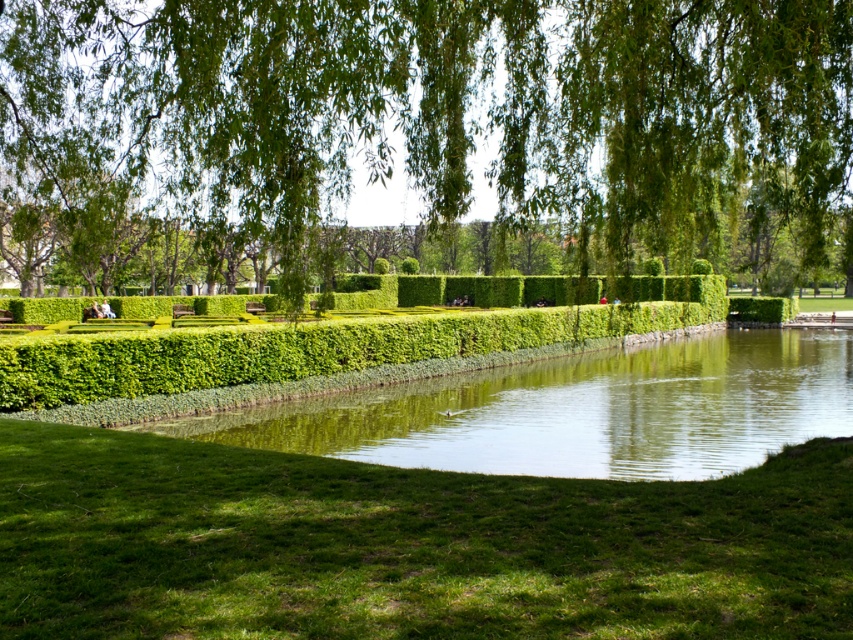
Looking at this image, you are a bird flying over the park and want to land on the green leafy willow at upper center before resting on the green smooth water at center. Which direction should you fly to reach the willow first?

The green leafy willow at upper center is to the left of the green smooth water at center, so you should fly to the left to reach the willow first before moving towards the water.

You are planning to place a picnic blanket in the park. The picnic blanket is 2 meters wide. You see the green grass at lower center and the green leafy hedge at center. Which area can accommodate the picnic blanket without overlapping the hedge?

The green grass at lower center has a width of less than 2 meters, so it cannot accommodate the picnic blanket. The green leafy hedge at center is wider, so placing the blanket there would overlap with the hedge. Therefore, neither area is suitable. However, since the question specifies choosing between the two, the hedge is wider but placing the blanket there would overlap. Perhaps the grass is too narrow. Wait, the description says the grass is less than the hedge. So the grass is narrower than the hedge.

You are a gardener planning to install a new pathway in the park. The pathway needs to be elevated to avoid waterlogging during rains. Considering the green grass at lower center and the green smooth water at center, which area should the pathway be placed closer to?

The pathway should be placed closer to the green grass at lower center because it has a lesser height compared to the green smooth water at center, which would help in directing water away from the pathway and prevent waterlogging.